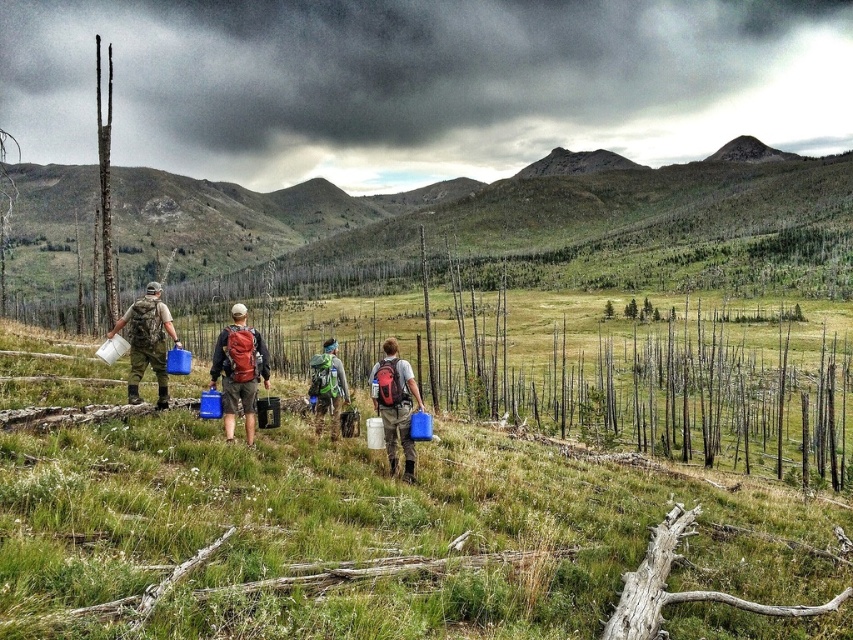
Question: Can you confirm if matte red backpack at center is thinner than matte black backpack at center?

Choices:
 (A) yes
 (B) no

Answer: (B)

Question: Which point appears closest to the camera in this image?

Choices:
 (A) (410, 438)
 (B) (642, 88)
 (C) (12, 285)
 (D) (109, 67)

Answer: (A)

Question: Can you confirm if matte black backpack at left is positioned above smooth brown tree trunk at left?

Choices:
 (A) no
 (B) yes

Answer: (A)

Question: Can you confirm if blue plastic bucket at center is bigger than matte black backpack at left?

Choices:
 (A) no
 (B) yes

Answer: (B)

Question: Considering the real-world distances, which object is closest to the dark gray cloud at upper center?

Choices:
 (A) green fabric backpack at center
 (B) green grassy hillside at upper left
 (C) matte black backpack at center

Answer: (B)

Question: Which point appears farthest from the camera in this image?

Choices:
 (A) (106, 148)
 (B) (227, 344)
 (C) (213, 381)
 (D) (132, 211)

Answer: (D)